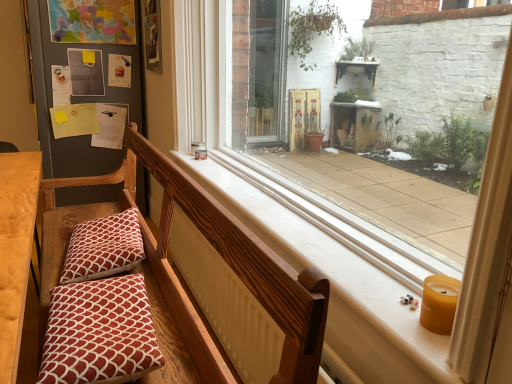
Question: Is smooth white window sill at center spatially inside yellow wax candle at lower right, or outside of it?

Choices:
 (A) inside
 (B) outside

Answer: (B)

Question: Based on their positions, is smooth white window sill at center located to the left or right of yellow wax candle at lower right?

Choices:
 (A) left
 (B) right

Answer: (A)

Question: Estimate the real-world distances between objects in this image. Which object is farther from the yellow wax candle at lower right?

Choices:
 (A) red printed cushion at lower left, which appears as the second pillow when viewed from the back
 (B) wooden church bench at center
 (C) wooden bench cushion at left
 (D) patterned fabric pillow at lower left, placed as the 1th pillow when sorted from back to front
 (E) smooth white window sill at center

Answer: (D)

Question: Based on their relative distances, which object is farther from the red printed cushion at lower left, the first pillow when ordered from front to back?

Choices:
 (A) patterned fabric pillow at lower left, placed as the 1th pillow when sorted from back to front
 (B) smooth white window sill at center
 (C) yellow wax candle at lower right
 (D) wooden church bench at center
 (E) wooden bench cushion at left

Answer: (C)